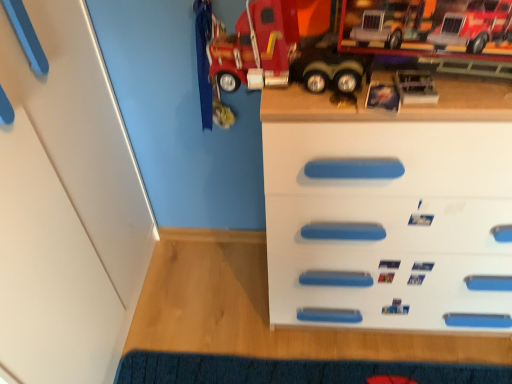
In order to click on vacant space that is to the left of white plastic chest of drawers at center in this screenshot , I will do `click(209, 296)`.